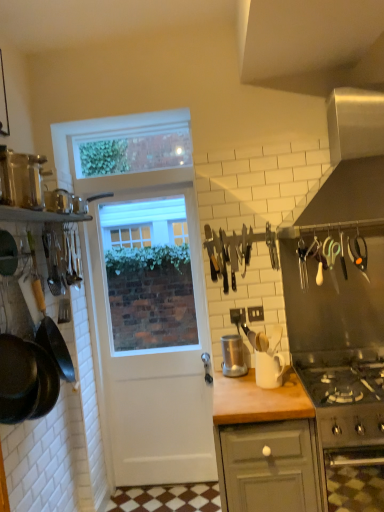
Find the location of `free spot in front of white ceramic mug at center, which is the 1th kitchen appliance in bottom-to-top order`. free spot in front of white ceramic mug at center, which is the 1th kitchen appliance in bottom-to-top order is located at coordinates pyautogui.click(x=276, y=394).